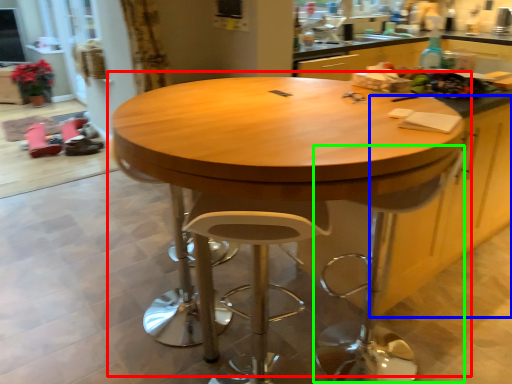
Question: Which is nearer to the table (highlighted by a red box)? cabinetry (highlighted by a blue box) or swivel chair (highlighted by a green box).

Choices:
 (A) cabinetry
 (B) swivel chair

Answer: (B)